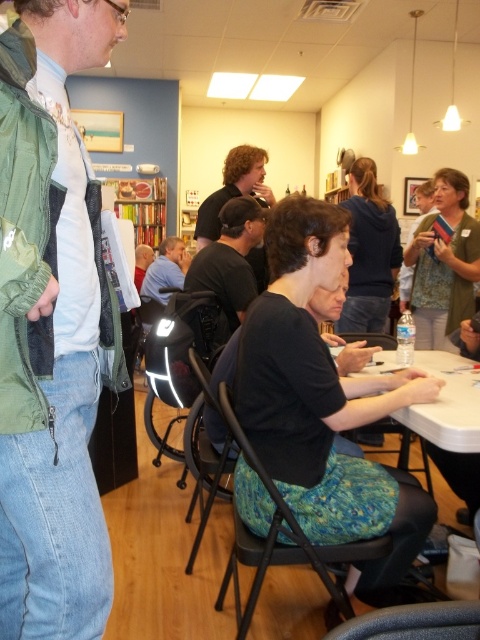
Question: Among these points, which one is farthest from the camera?

Choices:
 (A) (83, 524)
 (B) (189, 284)
 (C) (171, 252)

Answer: (C)

Question: Is the position of black shirt at center less distant than that of dark brown hair at center?

Choices:
 (A) no
 (B) yes

Answer: (B)

Question: Which of these objects is positioned farthest from the dark brown hair at center?

Choices:
 (A) blue fabric shirt at center
 (B) dark blue sweater at center
 (C) fabric cushioned chair at lower center
 (D) green fabric jacket at left

Answer: (C)

Question: Which object is the farthest from the green floral dress at center?

Choices:
 (A) black shirt at center
 (B) dark blue sweater at center

Answer: (A)

Question: Is green floral dress at center bigger than dark blue sweater at center?

Choices:
 (A) yes
 (B) no

Answer: (A)

Question: Can you confirm if green floral dress at center is wider than black shirt at center?

Choices:
 (A) no
 (B) yes

Answer: (A)